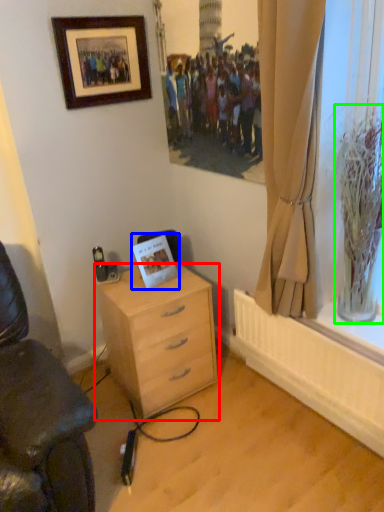
Question: Which object is positioned farthest from desk (highlighted by a red box)? Select from postcard (highlighted by a blue box) and glass vase (highlighted by a green box).

Choices:
 (A) postcard
 (B) glass vase

Answer: (B)